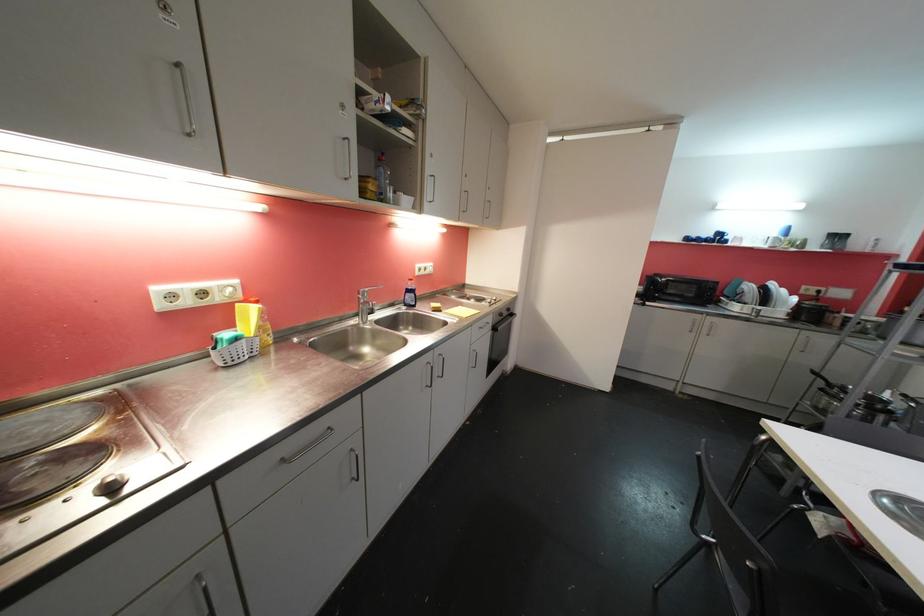
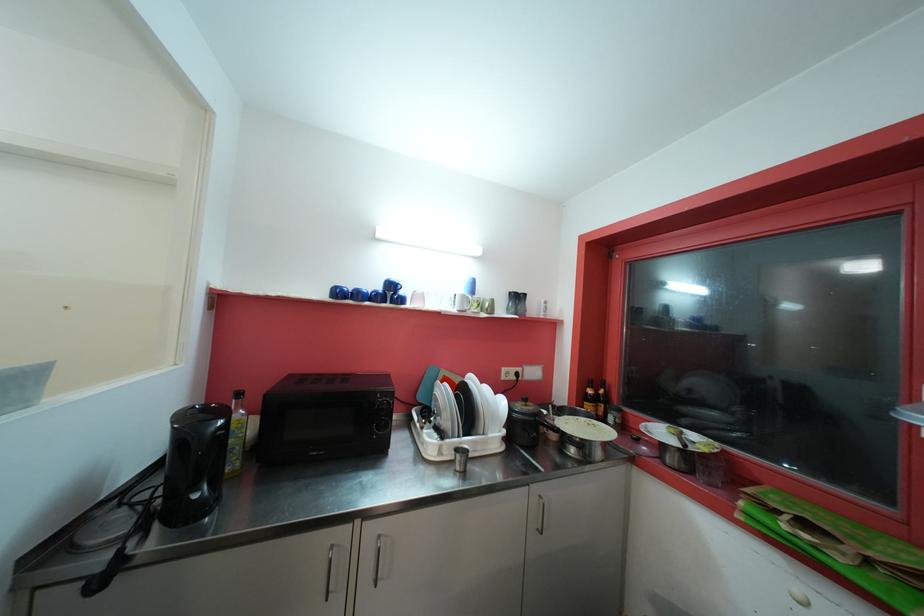
Find the pixel in the second image that matches (x=691, y=241) in the first image.

(343, 294)